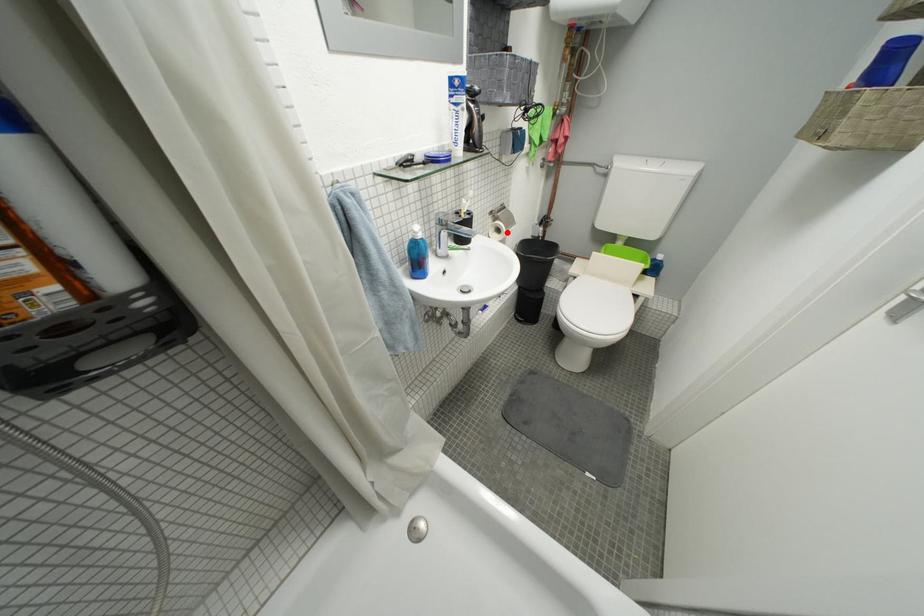
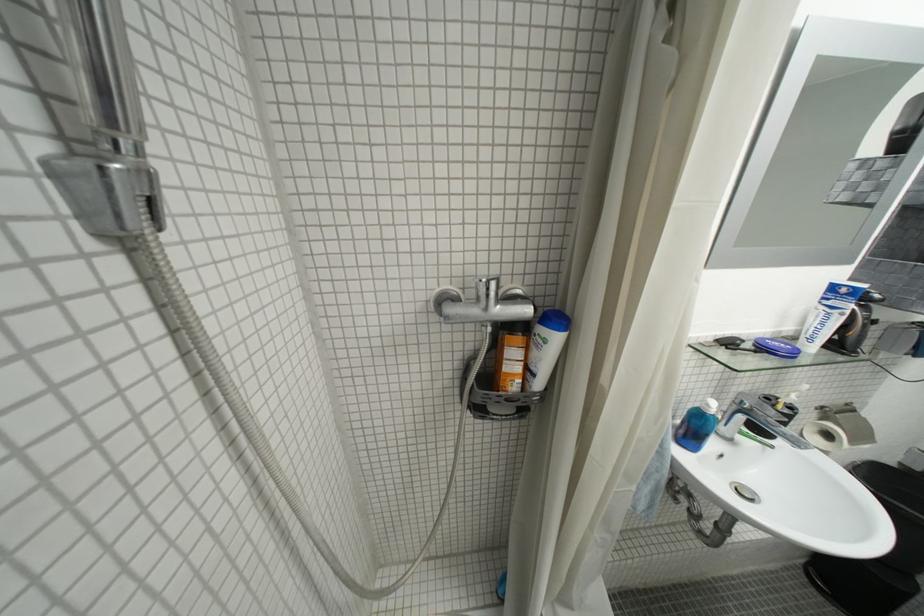
Question: I am providing you with two images of the same scene from different viewpoints. In image1, a red point is highlighted. Considering the same 3D point in image2, which of the following is correct?

Choices:
 (A) It is closer
 (B) It is farther

Answer: (A)